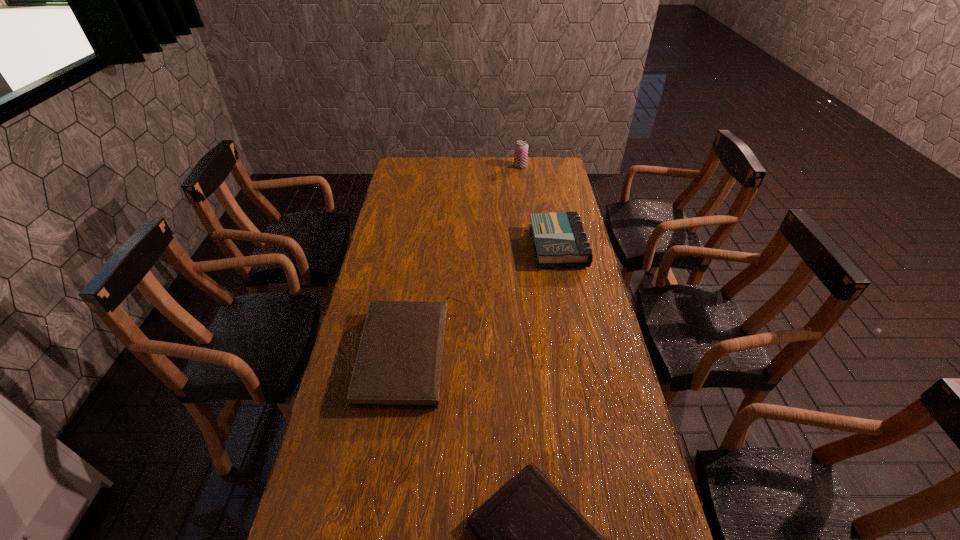
You are a GUI agent. You are given a task and a screenshot of the screen. Output one action in this format:
    pyautogui.click(x=<x>, y=<y>)
    Task: Click on the object located in the left edge section of the desktop
    
    Given the screenshot: What is the action you would take?
    pyautogui.click(x=399, y=361)

You are a GUI agent. You are given a task and a screenshot of the screen. Output one action in this format:
    pyautogui.click(x=<x>, y=<y>)
    Task: Click on the object that is at the right edge
    The image size is (960, 540).
    Given the screenshot: What is the action you would take?
    pyautogui.click(x=558, y=238)

At what (x,y) coordinates should I click in order to perform the action: click on free space at the far edge. Please return your answer as a coordinate pair (x, y). Looking at the image, I should click on (497, 160).

Find the location of a particular element. vacant point at the left edge is located at coordinates (389, 270).

Find the location of a particular element. This screenshot has width=960, height=540. free space at the right edge is located at coordinates (567, 194).

In the image, there is a desktop. Where is `vacant space at the far right corner`? vacant space at the far right corner is located at coordinates (563, 179).

Find the location of `free area in between the third nearest object and the second tallest paperback book`. free area in between the third nearest object and the second tallest paperback book is located at coordinates (488, 301).

You are a GUI agent. You are given a task and a screenshot of the screen. Output one action in this format:
    pyautogui.click(x=<x>, y=<y>)
    Task: Click on the free space between the second farthest object and the second nearest paperback book
    
    Given the screenshot: What is the action you would take?
    pyautogui.click(x=488, y=301)

Identify the location of unoccupied position between the second nearest paperback book and the second tallest object. The width and height of the screenshot is (960, 540). (488, 301).

Choose which object is the nearest neighbor to the nearest paperback book. Please provide its 2D coordinates. Your answer should be formatted as a tuple, i.e. [(x, y)], where the tuple contains the x and y coordinates of a point satisfying the conditions above.

[(399, 361)]